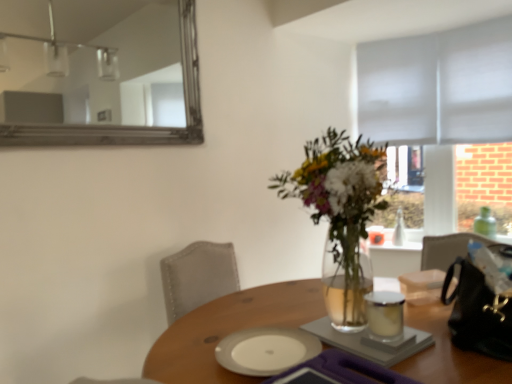
The height and width of the screenshot is (384, 512). Describe the element at coordinates (266, 350) in the screenshot. I see `white ceramic plate at center, which is counted as the 2th tableware, starting from the top` at that location.

This screenshot has height=384, width=512. What are the coordinates of `wooden table at center` in the screenshot? It's located at (229, 330).

The height and width of the screenshot is (384, 512). Identify the location of gray fabric blind at upper right. (438, 86).

The height and width of the screenshot is (384, 512). Describe the element at coordinates (340, 213) in the screenshot. I see `translucent glass vase at center` at that location.

What do you see at coordinates (102, 68) in the screenshot? The image size is (512, 384). I see `silver-framed mirror at upper left` at bounding box center [102, 68].

Find the location of `white glossy candle at center, marked as the second tableware in a bottom-to-top arrangement`. white glossy candle at center, marked as the second tableware in a bottom-to-top arrangement is located at coordinates (385, 315).

Can you confirm if white glossy candle at center, marked as the second tableware in a bottom-to-top arrangement, is wider than white ceramic plate at center, the first tableware ordered from the bottom?

Incorrect, the width of white glossy candle at center, marked as the second tableware in a bottom-to-top arrangement, does not surpass that of white ceramic plate at center, the first tableware ordered from the bottom.

Looking at this image, are white glossy candle at center, which appears as the second tableware when viewed from the left, and white ceramic plate at center, marked as the 2th tableware in a right-to-left arrangement, beside each other?

No, white glossy candle at center, which appears as the second tableware when viewed from the left, is not touching white ceramic plate at center, marked as the 2th tableware in a right-to-left arrangement.

The height and width of the screenshot is (384, 512). Identify the location of tableware above the white ceramic plate at center, which is counted as the 2th tableware, starting from the top (from a real-world perspective). (385, 315).

Considering the relative sizes of white glossy candle at center, which is the 1th tableware from top to bottom, and white ceramic plate at center, marked as the 2th tableware in a right-to-left arrangement, in the image provided, is white glossy candle at center, which is the 1th tableware from top to bottom, smaller than white ceramic plate at center, marked as the 2th tableware in a right-to-left arrangement,?

Indeed, white glossy candle at center, which is the 1th tableware from top to bottom, has a smaller size compared to white ceramic plate at center, marked as the 2th tableware in a right-to-left arrangement.

Considering the relative sizes of wooden table at center and gray fabric blind at upper right in the image provided, is wooden table at center shorter than gray fabric blind at upper right?

Yes.

In order to click on blind on the right of wooden table at center in this screenshot , I will do `click(438, 86)`.

Is point (203, 357) closer to camera compared to point (362, 108)?

Yes.

Considering the positions of objects wooden table at center and gray fabric blind at upper right in the image provided, who is more to the left, wooden table at center or gray fabric blind at upper right?

Positioned to the left is wooden table at center.

Can you confirm if wooden table at center is shorter than white glossy candle at center, which appears as the second tableware when viewed from the left?

No.

Between wooden table at center and white glossy candle at center, which appears as the second tableware when viewed from the left, which one has larger size?

wooden table at center.

How many degrees apart are the facing directions of wooden table at center and white glossy candle at center, which is the 1th tableware from top to bottom?

wooden table at center and white glossy candle at center, which is the 1th tableware from top to bottom, are facing 113 degrees away from each other.

From a real-world perspective, relative to white ceramic plate at center, marked as the 2th tableware in a right-to-left arrangement, is wooden table at center vertically above or below?

In terms of real-world spatial position, wooden table at center is above white ceramic plate at center, marked as the 2th tableware in a right-to-left arrangement.

Can you confirm if wooden table at center is wider than white ceramic plate at center, which is counted as the 1th tableware, starting from the left?

Indeed, wooden table at center has a greater width compared to white ceramic plate at center, which is counted as the 1th tableware, starting from the left.

Who is more distant, wooden table at center or white ceramic plate at center, which is counted as the 2th tableware, starting from the top?

white ceramic plate at center, which is counted as the 2th tableware, starting from the top, is further from the camera.

Consider the image. Is wooden table at center far away from white ceramic plate at center, which is counted as the 2th tableware, starting from the top?

wooden table at center is near white ceramic plate at center, which is counted as the 2th tableware, starting from the top, not far away.

Is point (58, 92) closer to camera compared to point (463, 376)?

No, it is behind (463, 376).

Can you tell me how much silver-framed mirror at upper left and wooden table at center differ in facing direction?

silver-framed mirror at upper left and wooden table at center are facing 108 degrees away from each other.

From a real-world perspective, who is located lower, silver-framed mirror at upper left or wooden table at center?

wooden table at center, from a real-world perspective.

Is silver-framed mirror at upper left inside or outside of wooden table at center?

silver-framed mirror at upper left is not enclosed by wooden table at center.

Choose the correct answer: Is white ceramic plate at center, which is counted as the 1th tableware, starting from the left, inside gray fabric blind at upper right or outside it?

white ceramic plate at center, which is counted as the 1th tableware, starting from the left, exists outside the volume of gray fabric blind at upper right.

Is white ceramic plate at center, the first tableware ordered from the bottom, far away from gray fabric blind at upper right?

Yes, white ceramic plate at center, the first tableware ordered from the bottom, is far from gray fabric blind at upper right.

Considering the sizes of objects white ceramic plate at center, marked as the 2th tableware in a right-to-left arrangement, and gray fabric blind at upper right in the image provided, who is smaller, white ceramic plate at center, marked as the 2th tableware in a right-to-left arrangement, or gray fabric blind at upper right?

With smaller size is white ceramic plate at center, marked as the 2th tableware in a right-to-left arrangement.

From a real-world perspective, which is physically below, white ceramic plate at center, marked as the 2th tableware in a right-to-left arrangement, or gray fabric blind at upper right?

From a 3D spatial view, white ceramic plate at center, marked as the 2th tableware in a right-to-left arrangement, is below.

Does translucent glass vase at center have a greater width compared to gray fabric blind at upper right?

Correct, the width of translucent glass vase at center exceeds that of gray fabric blind at upper right.

What are the coordinates of `blind above the translucent glass vase at center (from the image's perspective)` in the screenshot? It's located at (438, 86).

Based on their sizes in the image, would you say translucent glass vase at center is bigger or smaller than gray fabric blind at upper right?

In the image, translucent glass vase at center appears to be larger than gray fabric blind at upper right.

The height and width of the screenshot is (384, 512). Identify the location of tableware behind the white ceramic plate at center, the first tableware ordered from the bottom. (385, 315).

Locate an element on the screen. The image size is (512, 384). table below the gray fabric blind at upper right (from a real-world perspective) is located at coordinates (229, 330).

Considering their positions, is white glossy candle at center, marked as the second tableware in a bottom-to-top arrangement, positioned further to translucent glass vase at center than gray fabric blind at upper right?

Among the two, gray fabric blind at upper right is located further to translucent glass vase at center.

Based on their spatial positions, is translucent glass vase at center or gray fabric blind at upper right further from silver-framed mirror at upper left?

The object further to silver-framed mirror at upper left is translucent glass vase at center.

Which object lies nearer to the anchor point wooden table at center, translucent glass vase at center or gray fabric blind at upper right?

The object closer to wooden table at center is translucent glass vase at center.

Looking at the image, which one is located closer to white glossy candle at center, which is the 1th tableware from top to bottom, translucent glass vase at center or white ceramic plate at center, marked as the 2th tableware in a right-to-left arrangement?

translucent glass vase at center is closer to white glossy candle at center, which is the 1th tableware from top to bottom.

Estimate the real-world distances between objects in this image. Which object is closer to white ceramic plate at center, the first tableware ordered from the bottom, silver-framed mirror at upper left or translucent glass vase at center?

Based on the image, translucent glass vase at center appears to be nearer to white ceramic plate at center, the first tableware ordered from the bottom.

Looking at this image, when comparing their distances from gray fabric blind at upper right, does white ceramic plate at center, which is counted as the 1th tableware, starting from the left, or translucent glass vase at center seem further?

white ceramic plate at center, which is counted as the 1th tableware, starting from the left, lies further to gray fabric blind at upper right than the other object.

Looking at this image, considering their positions, is silver-framed mirror at upper left positioned closer to white ceramic plate at center, marked as the 2th tableware in a right-to-left arrangement, than white glossy candle at center, which appears as the second tableware when viewed from the left?

white glossy candle at center, which appears as the second tableware when viewed from the left, is positioned closer to the anchor white ceramic plate at center, marked as the 2th tableware in a right-to-left arrangement.

When comparing their distances from white ceramic plate at center, marked as the 2th tableware in a right-to-left arrangement, does wooden table at center or white glossy candle at center, which appears as the second tableware when viewed from the left, seem closer?

Among the two, wooden table at center is located nearer to white ceramic plate at center, marked as the 2th tableware in a right-to-left arrangement.

Where is `houseplant between silver-framed mirror at upper left and white ceramic plate at center, which is counted as the 1th tableware, starting from the left, in the up-down direction`? houseplant between silver-framed mirror at upper left and white ceramic plate at center, which is counted as the 1th tableware, starting from the left, in the up-down direction is located at coordinates (340, 213).

Identify the location of tableware between silver-framed mirror at upper left and white ceramic plate at center, marked as the 2th tableware in a right-to-left arrangement, vertically. The image size is (512, 384). (385, 315).

Locate an element on the screen. houseplant between silver-framed mirror at upper left and wooden table at center vertically is located at coordinates coord(340,213).

Identify the location of houseplant between wooden table at center and gray fabric blind at upper right in the front-back direction. The width and height of the screenshot is (512, 384). (340, 213).